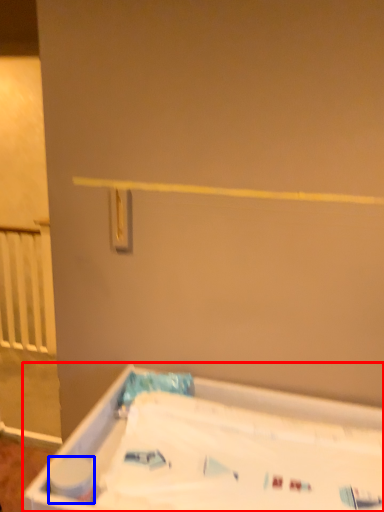
Question: Among these objects, which one is farthest to the camera, bathtub (highlighted by a red box) or toilet paper (highlighted by a blue box)?

Choices:
 (A) bathtub
 (B) toilet paper

Answer: (B)